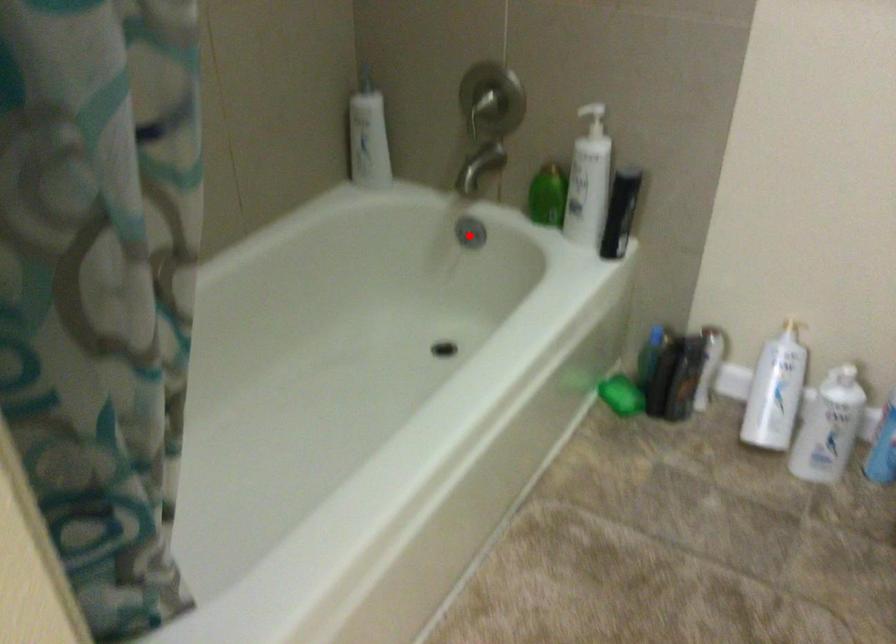
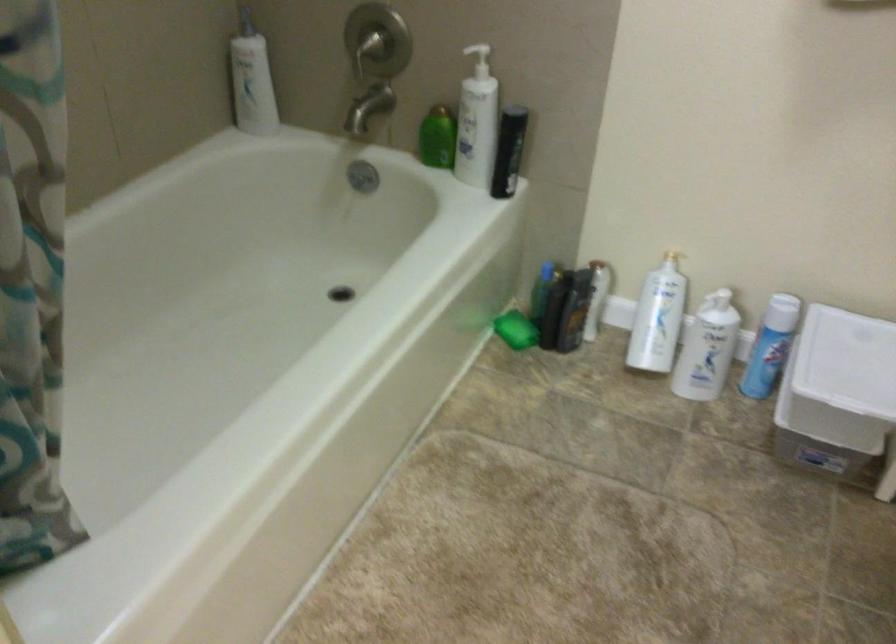
Where in the second image is the point corresponding to the highlighted location from the first image?

(362, 176)